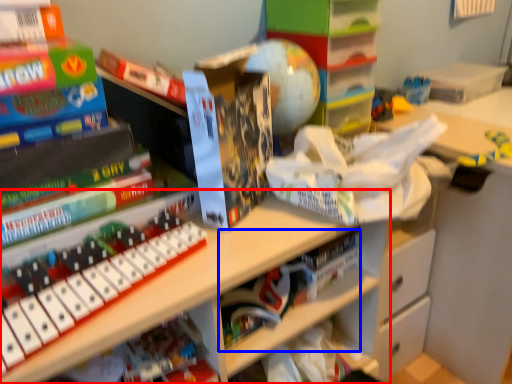
Question: Which object is closer to the camera taking this photo, shelf (highlighted by a red box) or book (highlighted by a blue box)?

Choices:
 (A) shelf
 (B) book

Answer: (A)